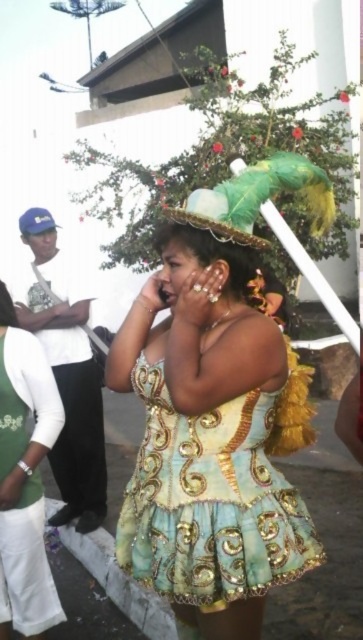
You are a photographer trying to capture the vibrant costume and headdress of the person in the image. You notice two points marked in the scene. The first point, point (176, 328), is located near the headdress, and the second point, point (30, 573), is near the bottom of the dress. To ensure the headdress is in focus, which point should you focus on?

You should focus on point (176, 328) because it is in front of point (30, 573), meaning the headdress is closer to the camera and thus requires focusing on that point to capture it clearly.

You are a photographer trying to capture a photo of the shiny gold dress at center and the green satin dress at center. Since you want to ensure both dresses are fully visible in the frame, which dress requires more space horizontally?

The shiny gold dress at center requires more space horizontally because its width surpasses that of the green satin dress at center.